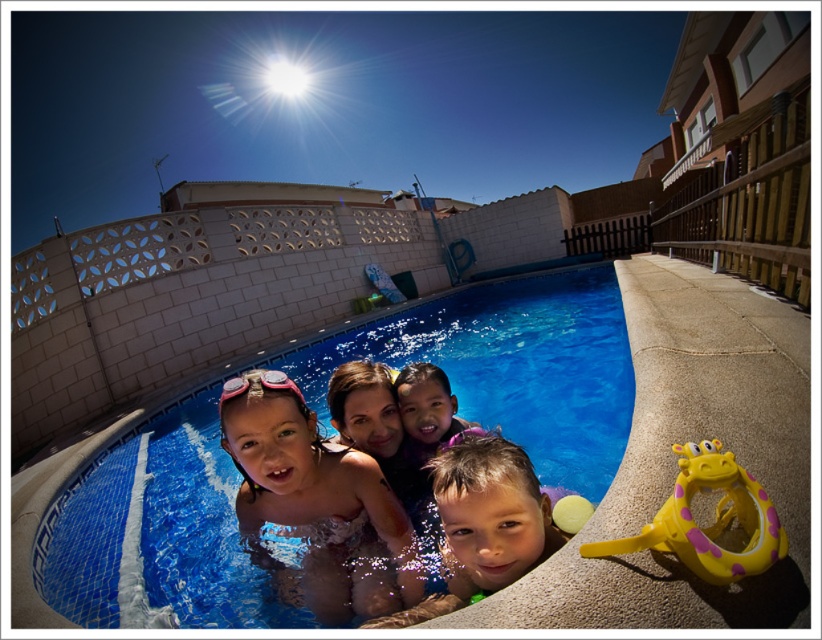
Is point (331, 456) positioned in front of point (266, 371)?

No, (331, 456) is behind (266, 371).

Does point (404, 515) come behind point (220, 401)?

Yes, point (404, 515) is farther from viewer.

Where is `pink rubber goggles at center`? pink rubber goggles at center is located at coordinates (317, 502).

Measure the distance between blue tile swimming pool at center and camera.

blue tile swimming pool at center is 1.31 meters away from camera.

How distant is blue tile swimming pool at center from yellow rubber ring at lower right?

The distance of blue tile swimming pool at center from yellow rubber ring at lower right is 6.61 feet.

Find the location of `blue tile swimming pool at center`. blue tile swimming pool at center is located at coordinates (511, 365).

At what (x,y) coordinates should I click in order to perform the action: click on blue tile swimming pool at center. Please return your answer as a coordinate pair (x, y). This screenshot has height=640, width=822. Looking at the image, I should click on (511, 365).

Can you confirm if blue tile swimming pool at center is smaller than pink rubber goggles at center?

Incorrect, blue tile swimming pool at center is not smaller in size than pink rubber goggles at center.

Locate an element on the screen. Image resolution: width=822 pixels, height=640 pixels. blue tile swimming pool at center is located at coordinates (511, 365).

This screenshot has height=640, width=822. I want to click on blue tile swimming pool at center, so click(x=511, y=365).